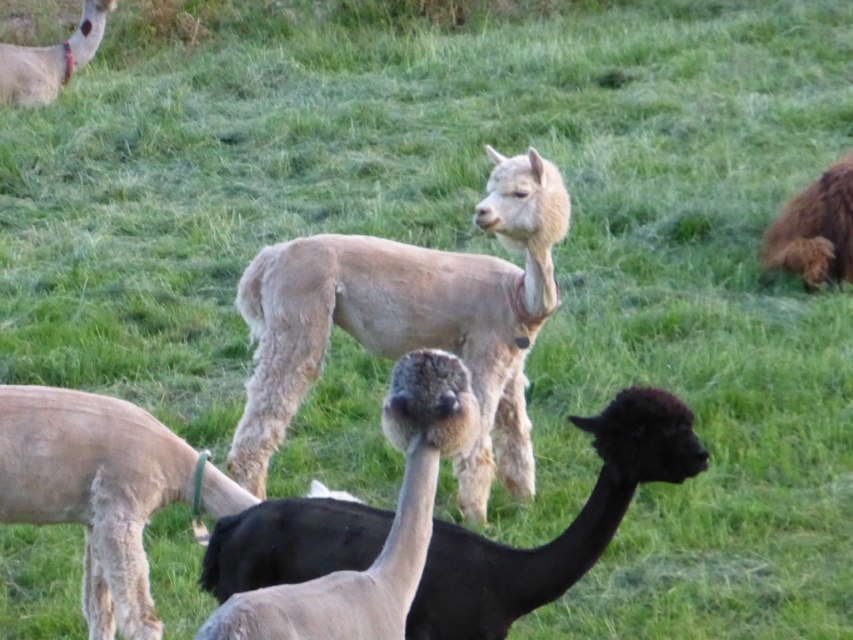
You are a farmer who wants to separate the black woolly alpaca at center and the light beige wool alpaca at upper left using a fence. The fence you have is 8 meters long. Can you place the fence between them to separate them?

The distance between the black woolly alpaca at center and the light beige wool alpaca at upper left is 8.68 meters. Since the fence is only 8 meters long, it is not long enough to cover the entire distance between them. Therefore, the fence cannot fully separate them.

You are a photographer trying to capture a clear photo of both the light beige wool alpaca at center and the black woolly alpaca at center. Which alpaca is closer to the camera, making it easier to focus on?

The light beige wool alpaca at center is closer to the camera since the black woolly alpaca at center is behind it.